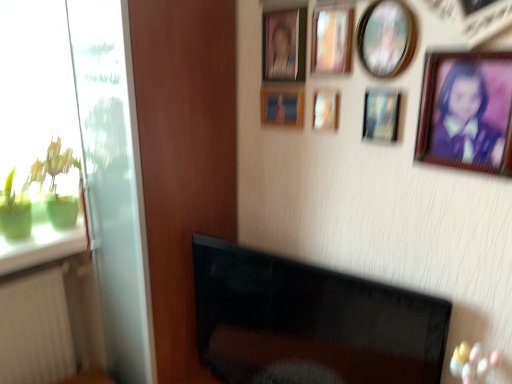
Question: Should I look upward or downward to see green glass at left?

Choices:
 (A) up
 (B) down

Answer: (B)

Question: Is white plastic radiator at lower left oriented towards wooden picture frame at upper center, marked as the 5th picture frame in a left-to-right arrangement?

Choices:
 (A) no
 (B) yes

Answer: (A)

Question: Is white plastic radiator at lower left turned away from wooden picture frame at upper center, marked as the 5th picture frame in a left-to-right arrangement?

Choices:
 (A) no
 (B) yes

Answer: (A)

Question: Is white plastic radiator at lower left smaller than wooden picture frame at upper center, marked as the 5th picture frame in a left-to-right arrangement?

Choices:
 (A) yes
 (B) no

Answer: (B)

Question: Is white plastic radiator at lower left positioned far away from wooden picture frame at upper center, the 3th picture frame positioned from the right?

Choices:
 (A) yes
 (B) no

Answer: (A)

Question: From a real-world perspective, is white plastic radiator at lower left on wooden picture frame at upper center, the 3th picture frame positioned from the right?

Choices:
 (A) no
 (B) yes

Answer: (A)

Question: Is white plastic radiator at lower left in front of wooden picture frame at upper center, the 3th picture frame positioned from the right?

Choices:
 (A) yes
 (B) no

Answer: (B)

Question: Is wooden picture frame at upper right, acting as the seventh picture frame starting from the left, completely or partially inside matte plastic picture frame at upper center, which is the 2th picture frame from left to right?

Choices:
 (A) yes
 (B) no

Answer: (B)

Question: Is matte plastic picture frame at upper center, arranged as the sixth picture frame when viewed from the right, positioned beyond the bounds of wooden picture frame at upper right, the 1th picture frame when ordered from right to left?

Choices:
 (A) no
 (B) yes

Answer: (B)

Question: Is matte plastic picture frame at upper center, which is the 2th picture frame from left to right, touching wooden picture frame at upper right, the 1th picture frame when ordered from right to left?

Choices:
 (A) yes
 (B) no

Answer: (B)

Question: Is matte plastic picture frame at upper center, which is the 2th picture frame from left to right, closer to the viewer compared to wooden picture frame at upper right, the 1th picture frame when ordered from right to left?

Choices:
 (A) yes
 (B) no

Answer: (B)

Question: Does matte plastic picture frame at upper center, arranged as the sixth picture frame when viewed from the right, come behind wooden picture frame at upper right, the 1th picture frame when ordered from right to left?

Choices:
 (A) no
 (B) yes

Answer: (B)

Question: Is matte plastic picture frame at upper center, arranged as the sixth picture frame when viewed from the right, looking in the opposite direction of wooden picture frame at upper right, the 1th picture frame when ordered from right to left?

Choices:
 (A) no
 (B) yes

Answer: (A)

Question: Is matte plastic picture frame at upper center, which is the 2th picture frame from left to right, to the left of transparent glass door at left from the viewer's perspective?

Choices:
 (A) yes
 (B) no

Answer: (B)